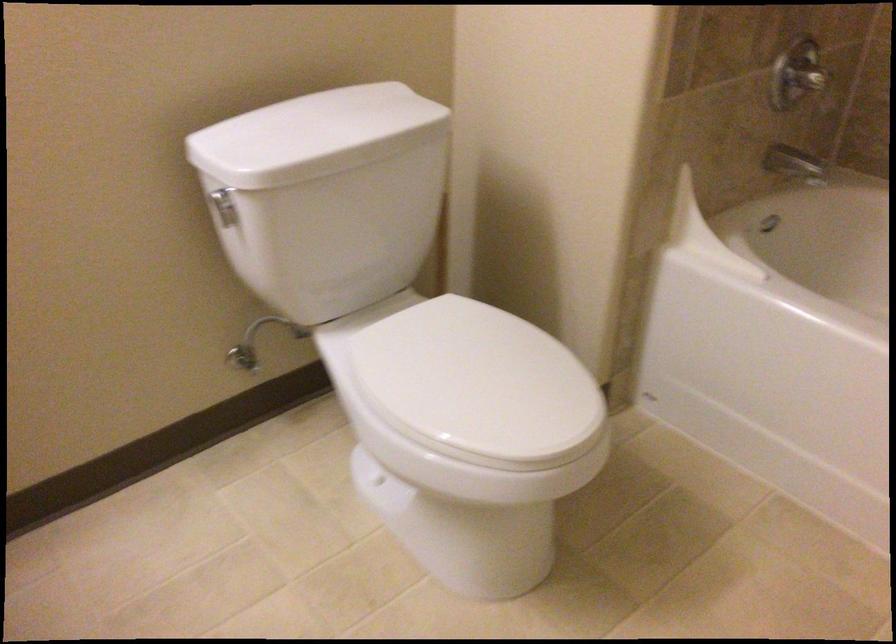
Identify the location of water valve handle. The width and height of the screenshot is (896, 644). (243, 357).